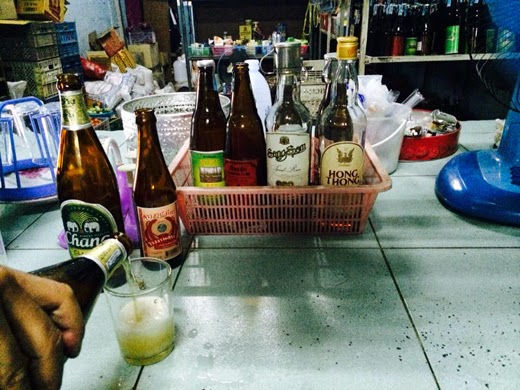
Locate an element on the screen. The height and width of the screenshot is (390, 520). metal pot is located at coordinates (180, 120).